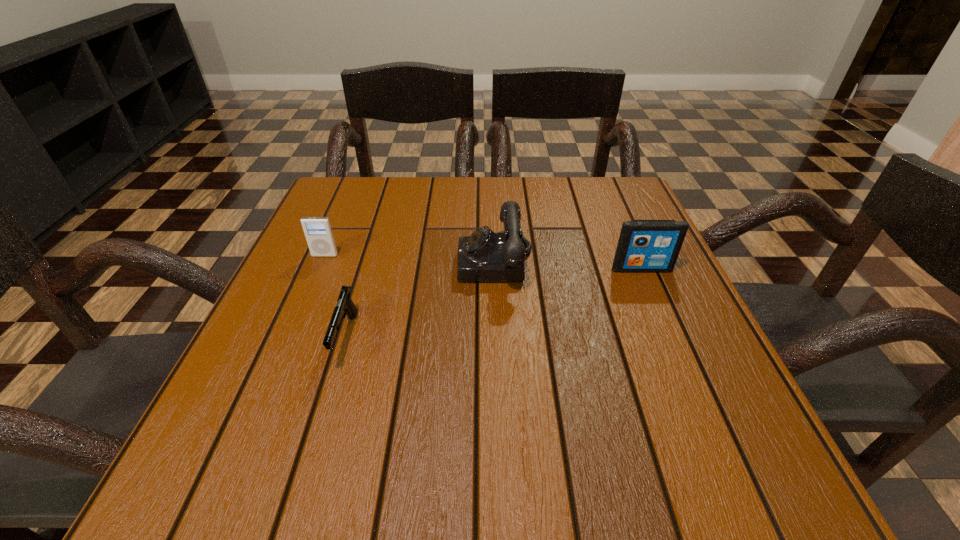
In the image, there is a desktop. Where is `free space at the near left corner`? free space at the near left corner is located at coordinates (243, 484).

The width and height of the screenshot is (960, 540). What are the coordinates of `vacant space at the far right corner` in the screenshot? It's located at (585, 204).

Locate an element on the screen. vacant region between the left iPod and the telephone is located at coordinates (410, 259).

The image size is (960, 540). Identify the location of empty space that is in between the gun and the rightmost object. (493, 303).

Where is `free space between the telephone and the second object from left to right`? free space between the telephone and the second object from left to right is located at coordinates pyautogui.click(x=420, y=300).

Identify the location of vacant area that lies between the shortest object and the leftmost object. The image size is (960, 540). (335, 296).

Find the location of a particular element. This screenshot has height=540, width=960. empty location between the farther iPod and the nearest object is located at coordinates (335, 296).

Identify the location of unoccupied position between the telephone and the leftmost object. Image resolution: width=960 pixels, height=540 pixels. (410, 259).

You are a GUI agent. You are given a task and a screenshot of the screen. Output one action in this format:
    pyautogui.click(x=<x>, y=<y>)
    Task: Click on the vacant area that lies between the shortest object and the third object from left to right
    
    Given the screenshot: What is the action you would take?
    pyautogui.click(x=420, y=300)

Image resolution: width=960 pixels, height=540 pixels. I want to click on free space between the telephone and the third object from right to left, so click(x=420, y=300).